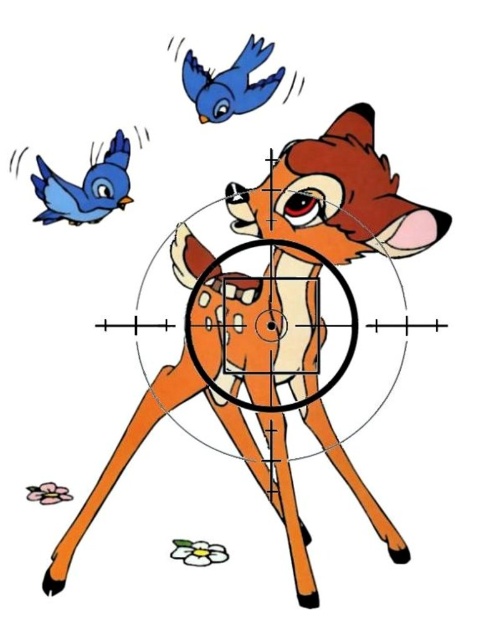
Does point (277, 202) lie in front of point (63, 205)?

No, (277, 202) is behind (63, 205).

Find the location of a particular element. orange matte deer at center is located at coordinates (335, 196).

This screenshot has width=502, height=640. I want to click on orange matte deer at center, so click(x=335, y=196).

Locate an element on the screen. The width and height of the screenshot is (502, 640). orange matte deer at center is located at coordinates (335, 196).